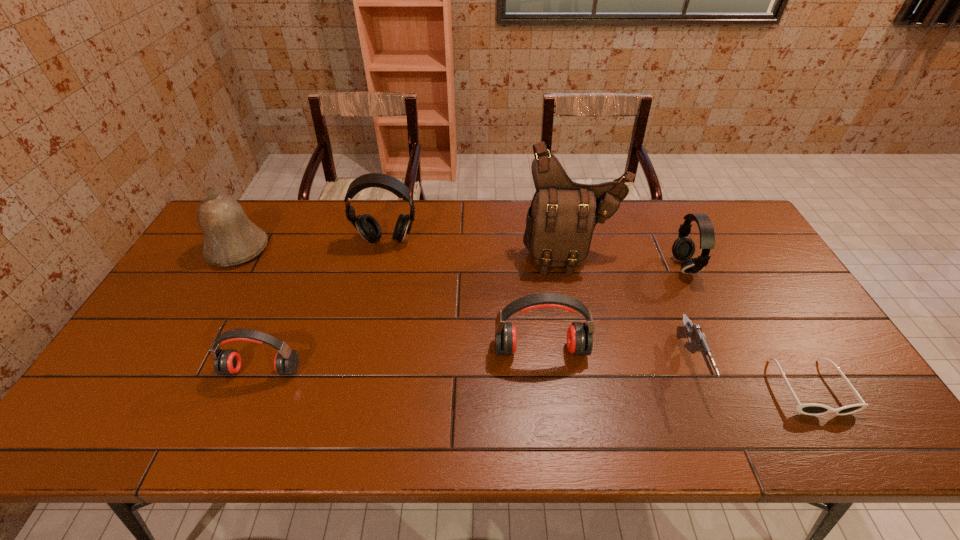
Image resolution: width=960 pixels, height=540 pixels. I want to click on the sixth tallest object, so click(x=227, y=362).

Where is `gun`? This screenshot has width=960, height=540. gun is located at coordinates (698, 342).

Where is `the sixth object from left to right`? The image size is (960, 540). the sixth object from left to right is located at coordinates (698, 342).

Locate an element on the screen. black sunglasses is located at coordinates (810, 408).

Where is `sunglasses`? sunglasses is located at coordinates (810, 408).

You are a GUI agent. You are given a task and a screenshot of the screen. Output one action in this format:
    pyautogui.click(x=<x>, y=<y>)
    Task: Click on the vacant point located on the front-facing side of the shoulder bag
    This screenshot has width=960, height=540.
    Given the screenshot: What is the action you would take?
    pyautogui.click(x=594, y=362)

Identify the location of blank area located on the ear cups of the second earphone from left to right. Image resolution: width=960 pixels, height=540 pixels. (372, 306).

Where is `vacant position located on the back of the bell`? The width and height of the screenshot is (960, 540). vacant position located on the back of the bell is located at coordinates (259, 213).

Image resolution: width=960 pixels, height=540 pixels. In order to click on vacant space located on the ear cups of the bigger red earphone in this screenshot , I will do `click(550, 426)`.

Find the location of a particular element. This screenshot has height=540, width=960. free region located on the ear cups of the right black earphone is located at coordinates (647, 266).